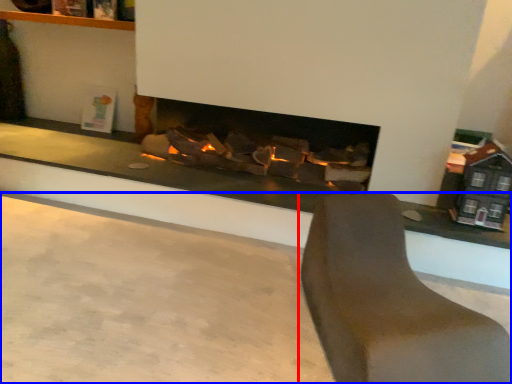
Question: Which object is closer to the camera taking this photo, furniture (highlighted by a red box) or concrete (highlighted by a blue box)?

Choices:
 (A) furniture
 (B) concrete

Answer: (B)